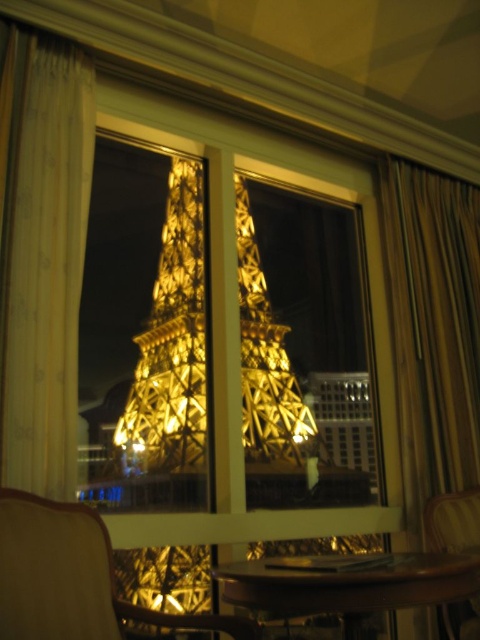
Question: Which of the following is the closest to the observer?

Choices:
 (A) (395, 566)
 (B) (447, 451)

Answer: (A)

Question: Where is gold fabric curtain at right located in relation to wooden armchair at lower right in the image?

Choices:
 (A) left
 (B) right

Answer: (A)

Question: Which object is farther from the camera taking this photo?

Choices:
 (A) wooden table at center
 (B) wooden armchair at lower left
 (C) gold fabric curtain at right
 (D) gold metallic eiffel tower at center

Answer: (D)

Question: Is wooden armchair at lower left below wooden table at center?

Choices:
 (A) no
 (B) yes

Answer: (A)

Question: Is gold metallic eiffel tower at center in front of wooden table at center?

Choices:
 (A) no
 (B) yes

Answer: (A)

Question: Estimate the real-world distances between objects in this image. Which object is farther from the white sheer curtain at left?

Choices:
 (A) wooden table at center
 (B) wooden armchair at lower right

Answer: (B)